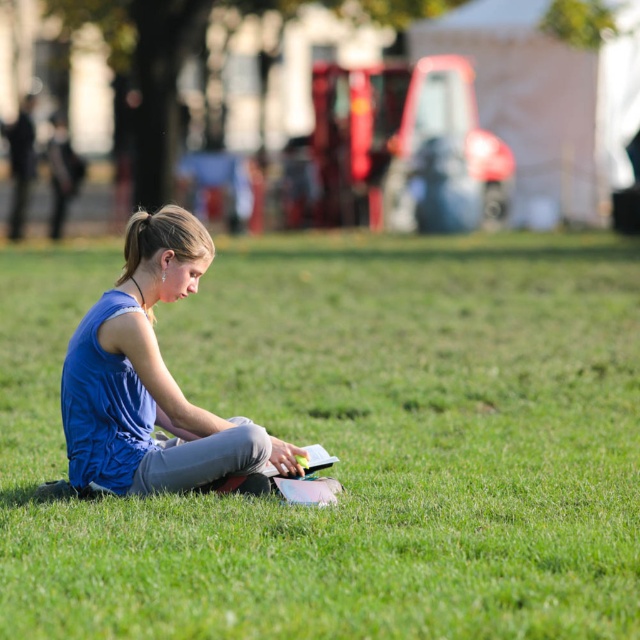
Can you confirm if green grassy at center is taller than blue fabric girl at center?

Yes.

The height and width of the screenshot is (640, 640). I want to click on green grassy at center, so click(x=349, y=442).

Is point (573, 291) behind point (92, 419)?

Yes, it is.

Identify the location of green grassy at center. (349, 442).